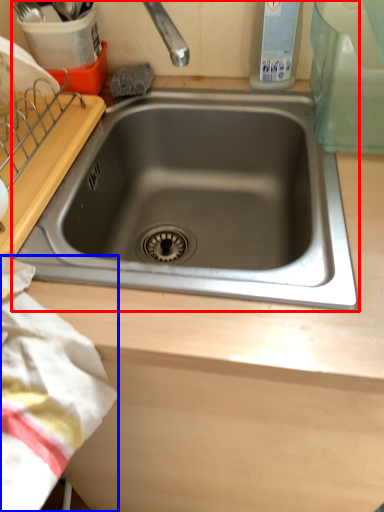
Question: Which object appears closest to the camera in this image, sink (highlighted by a red box) or blanket (highlighted by a blue box)?

Choices:
 (A) sink
 (B) blanket

Answer: (B)